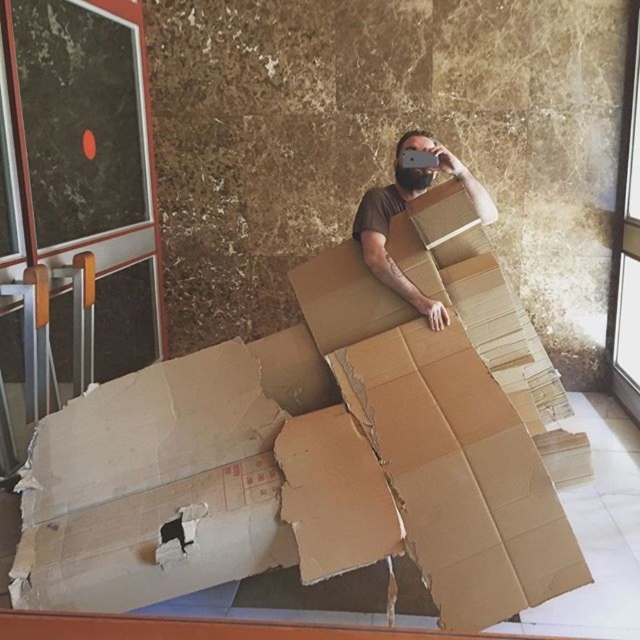
Who is positioned more to the right, brown corrugated cardboard at center or brown cardboard at center?

brown cardboard at center

Find the location of `brown corrugated cardboard at center`. brown corrugated cardboard at center is located at coordinates (320, 449).